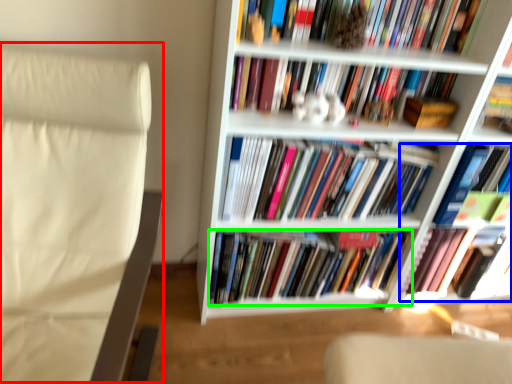
Question: Based on their relative distances, which object is farther from rocking chair (highlighted by a red box)? Choose from book (highlighted by a blue box) and book (highlighted by a green box).

Choices:
 (A) book
 (B) book

Answer: (A)